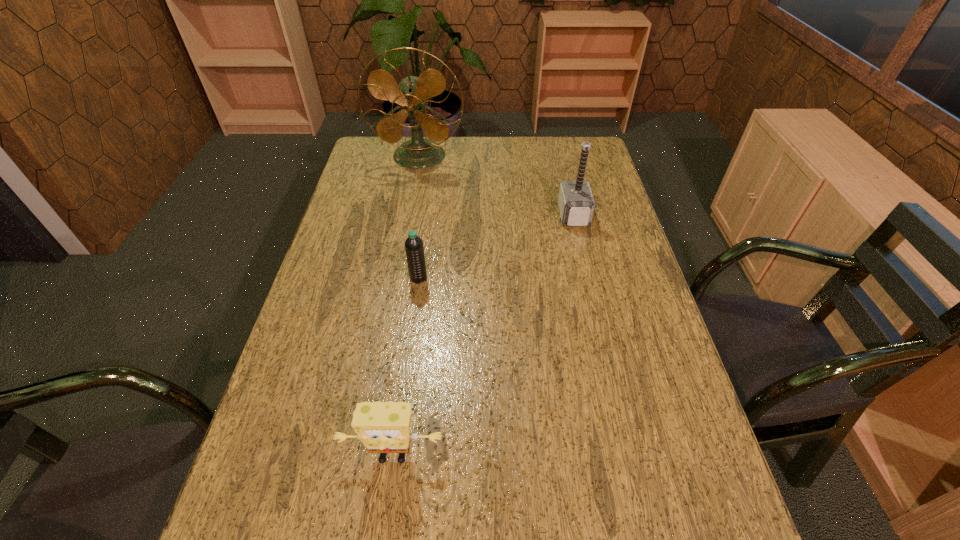
Where is `vacant point located between the sponge and the second farthest object`? This screenshot has height=540, width=960. vacant point located between the sponge and the second farthest object is located at coordinates (483, 335).

Locate which object ranks in proximity to the farthest object. Please provide its 2D coordinates. Your answer should be formatted as a tuple, i.e. [(x, y)], where the tuple contains the x and y coordinates of a point satisfying the conditions above.

[(576, 204)]

Locate which object is the third closest to the sponge. Please provide its 2D coordinates. Your answer should be formatted as a tuple, i.e. [(x, y)], where the tuple contains the x and y coordinates of a point satisfying the conditions above.

[(412, 95)]

This screenshot has height=540, width=960. What are the coordinates of `vacant position in the image that satisfies the following two spatial constraints: 1. for striking with the head of the second farthest object; 2. on the face of the nearest object` in the screenshot? It's located at (630, 456).

Identify the location of free space in the image that satisfies the following two spatial constraints: 1. for striking with the head of the third nearest object; 2. on the face of the sponge. This screenshot has height=540, width=960. (630, 456).

Find the location of a particular element. vacant area in the image that satisfies the following two spatial constraints: 1. in front of the third farthest object, directing air flow; 2. on the right side of the tallest object is located at coordinates (396, 278).